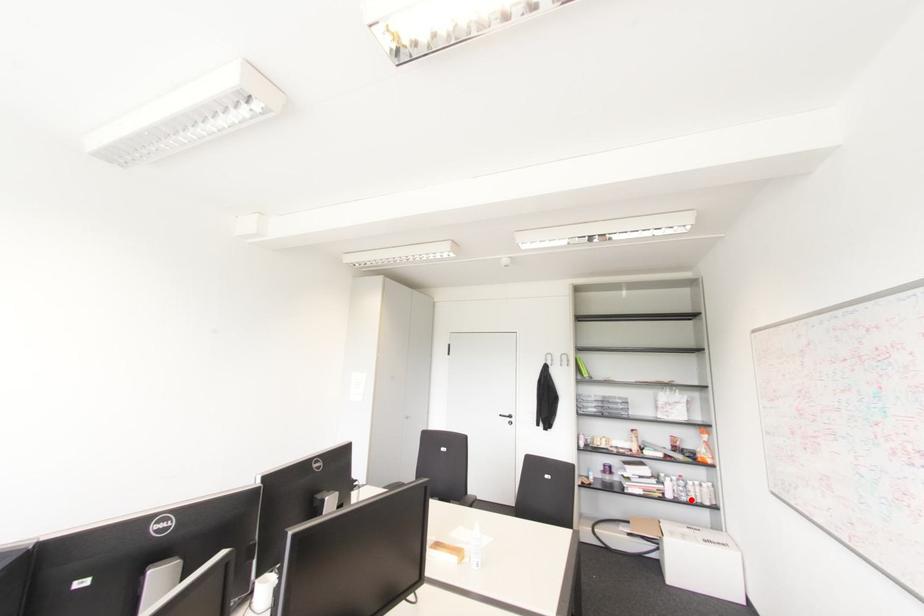
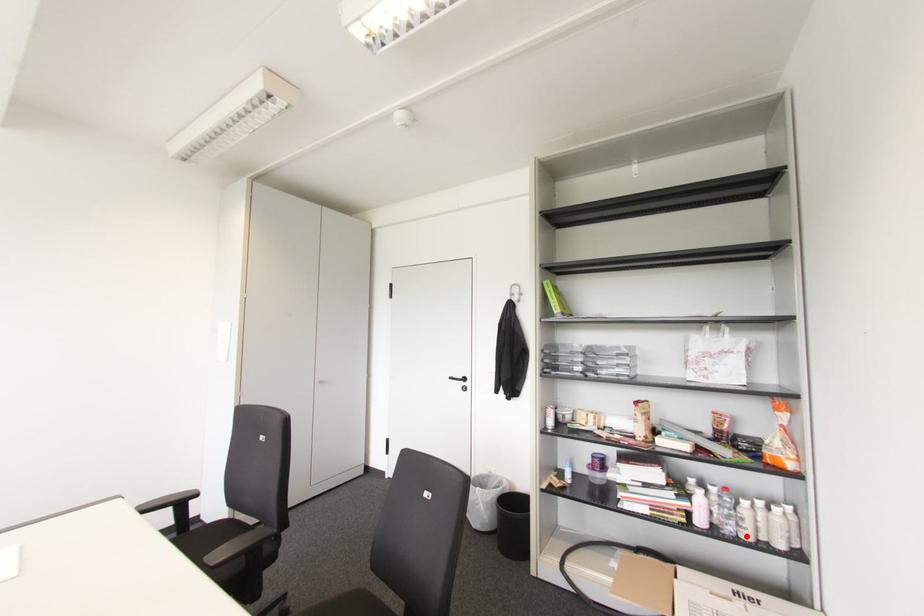
From the picture: I am providing you with two images of the same scene from different viewpoints. A red point is marked on the first image and another point is marked on the second image. Are the points marked in image1 and image2 representing the same 3D position?

Yes